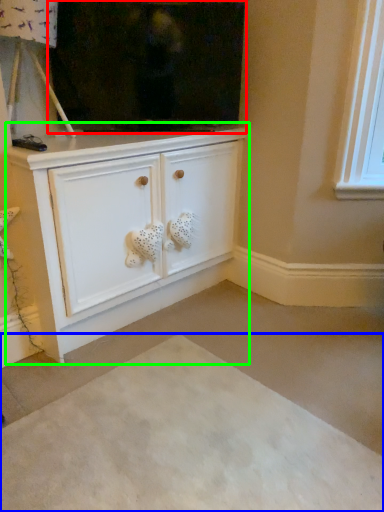
Question: Which is nearer to the fireplace (highlighted by a red box)? plain (highlighted by a blue box) or cabinetry (highlighted by a green box).

Choices:
 (A) plain
 (B) cabinetry

Answer: (B)